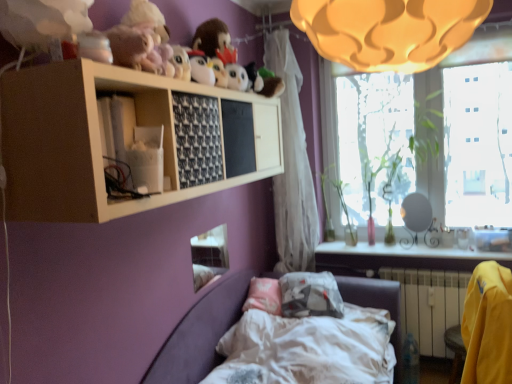
Question: Is velvet purple bed at lower center bigger or smaller than white matte shelf at upper center?

Choices:
 (A) small
 (B) big

Answer: (B)

Question: In terms of width, does velvet purple bed at lower center look wider or thinner when compared to white matte shelf at upper center?

Choices:
 (A) thin
 (B) wide

Answer: (B)

Question: Which object is the farthest from the white matte shelf at upper center?

Choices:
 (A) translucent glass window at upper right
 (B) white plastic radiator at lower right
 (C) yellow fabric armchair at lower right
 (D) white sheer curtain at center
 (E) velvet purple bed at lower center

Answer: (A)

Question: Estimate the real-world distances between objects in this image. Which object is farther from the velvet purple bed at lower center?

Choices:
 (A) translucent glass window at upper right
 (B) yellow fabric armchair at lower right
 (C) white sheer curtain at center
 (D) white plastic radiator at lower right
 (E) white matte shelf at upper center

Answer: (A)